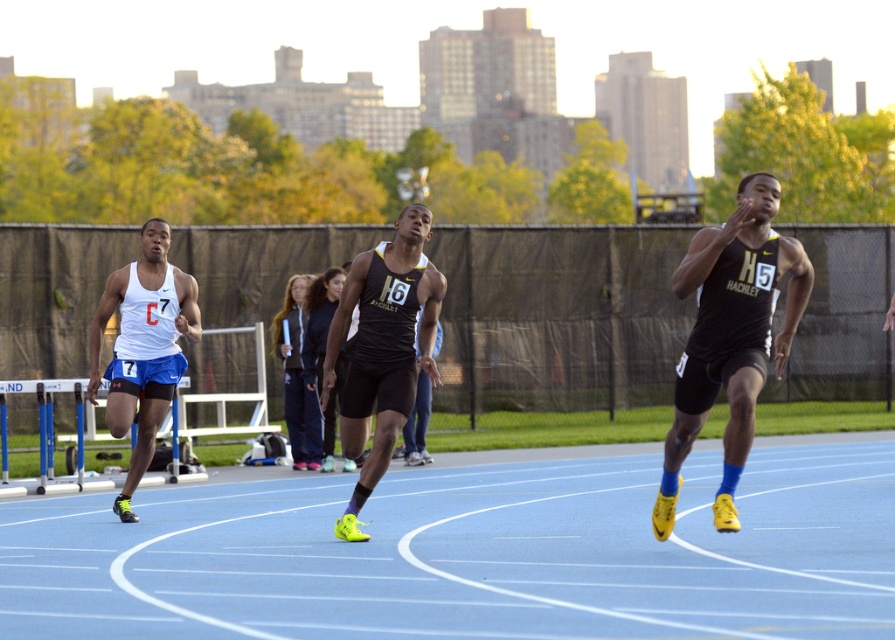
You are a photographer standing at the starting line of the sprint race. You want to capture a closeup shot of the black matte running shoe at right. Based on the scene, is the shoe within your camera lens range if the minimum focus distance is 10 meters?

The black matte running shoe at right is 11.34 meters away from the viewer. Since the minimum focus distance is 10 meters, the shoe is within the camera lens range as 11.34 meters exceeds the minimum requirement.

Consider the image. You are a photographer at the track and field event. You want to capture a photo of the athlete wearing the matte black singlet at center and dark blue track pants at center. Based on their position, will the singlet be visible in the photo?

The matte black singlet at center is positioned over dark blue track pants at center, so yes, the singlet will be visible in the photo as it is covering the track pants.

You are a photographer at the track event. You need to capture a closeup of the athlete wearing the matte black singlet at center and the dark blue track pants at center. When zooming in, which piece of clothing will appear bigger in your photo?

The matte black singlet at center will appear bigger in the photo because it is larger in size than the dark blue track pants at center.